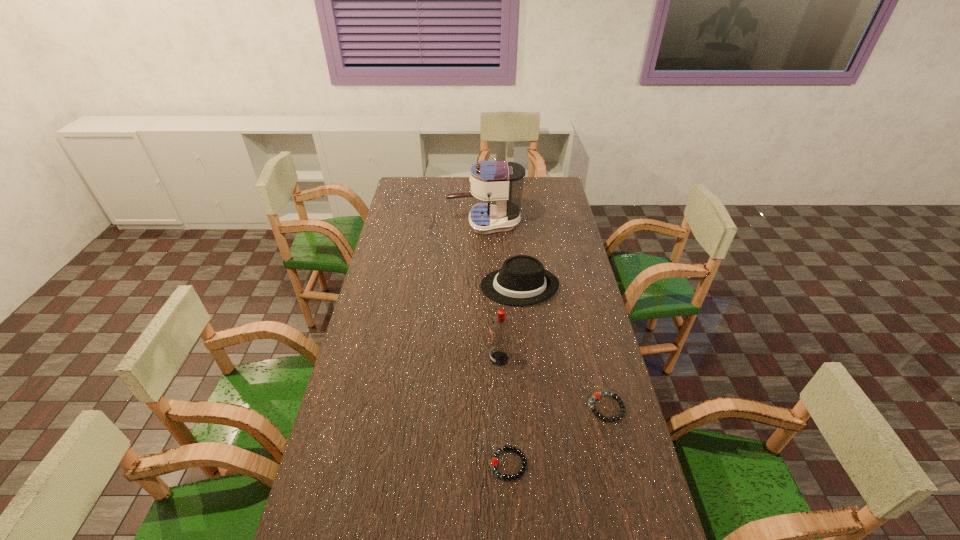
You are a GUI agent. You are given a task and a screenshot of the screen. Output one action in this format:
    pyautogui.click(x=<x>, y=<y>)
    Task: Click on the free space that satisfies the following two spatial constraints: 1. on the front label of the rightmost object; 2. on the right side of the third farthest object
    
    Given the screenshot: What is the action you would take?
    pyautogui.click(x=501, y=408)